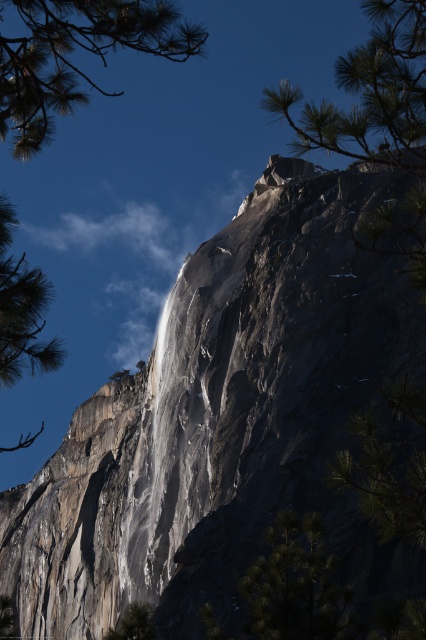
From the picture: You are a hiker standing at the base of the cliff. You notice two points marked on the cliff face. The first point is at coordinates point (19, 358) and the second is at point (111, 628). Which point is closer to you as you look at the cliff?

Point (19, 358) is in front of point (111, 628), so it is closer to you as you look at the cliff.

You are a hiker who wants to take a photo of the green pine branch at upper left and the green textured pine tree at left. Which one should you zoom in on to capture more details?

The green pine branch at upper left is not as tall as the green textured pine tree at left, so you should zoom in on the green textured pine tree at left to capture more details because it is taller and likely larger in size.